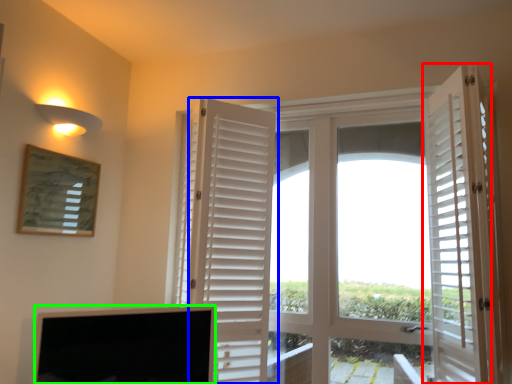
Question: Which object is the closest to the door (highlighted by a red box)? Choose among these: door (highlighted by a blue box) or screen (highlighted by a green box).

Choices:
 (A) door
 (B) screen

Answer: (A)